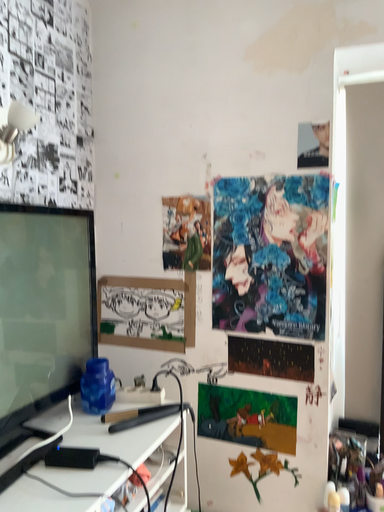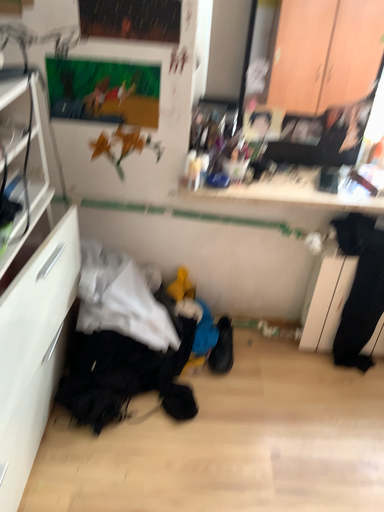
Question: Which way did the camera rotate in the video?

Choices:
 (A) rotated right
 (B) rotated left

Answer: (A)